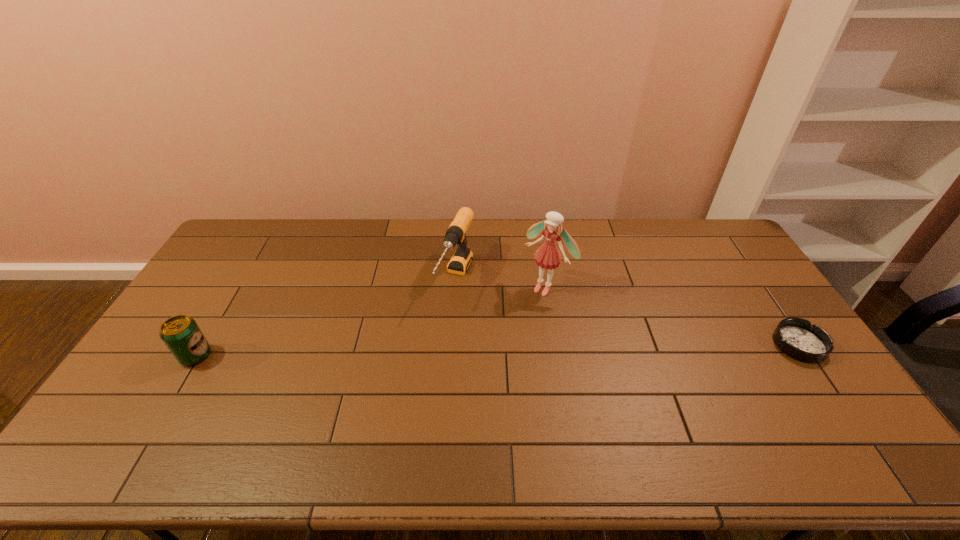
Identify the location of vacant position located 0.300m on the front-facing side of the doll. (478, 357).

This screenshot has width=960, height=540. I want to click on vacant space located on the front-facing side of the doll, so click(x=487, y=348).

Locate an element on the screen. free space located on the front-facing side of the doll is located at coordinates (459, 378).

The width and height of the screenshot is (960, 540). I want to click on free space located 0.230m on the handle side of the third shortest object, so click(421, 368).

The height and width of the screenshot is (540, 960). I want to click on free spot located 0.090m on the handle side of the third shortest object, so click(439, 332).

The image size is (960, 540). What are the coordinates of `vacant region located on the handle side of the third shortest object` in the screenshot? It's located at (412, 388).

The image size is (960, 540). In order to click on object that is at the far edge in this screenshot , I will do `click(460, 261)`.

Locate an element on the screen. The image size is (960, 540). object that is at the left edge is located at coordinates 181,334.

Locate an element on the screen. The height and width of the screenshot is (540, 960). object situated at the right edge is located at coordinates (797, 338).

Find the location of a particular element. vacant position at the far edge of the desktop is located at coordinates (616, 240).